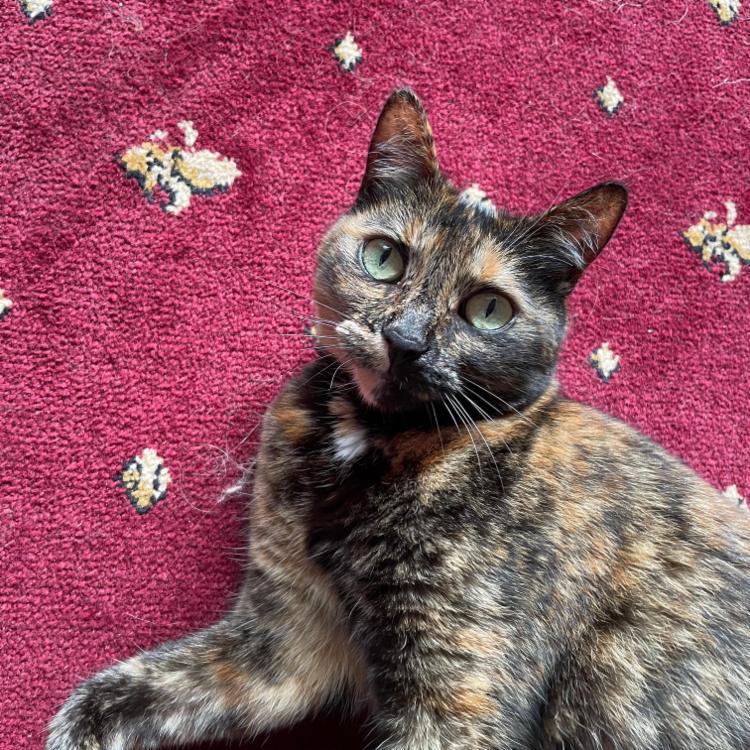
You are a GUI agent. You are given a task and a screenshot of the screen. Output one action in this format:
    pyautogui.click(x=<x>, y=<y>)
    Task: Click on the red blanket
    
    Given the screenshot: What is the action you would take?
    pyautogui.click(x=42, y=577), pyautogui.click(x=661, y=374), pyautogui.click(x=522, y=148)